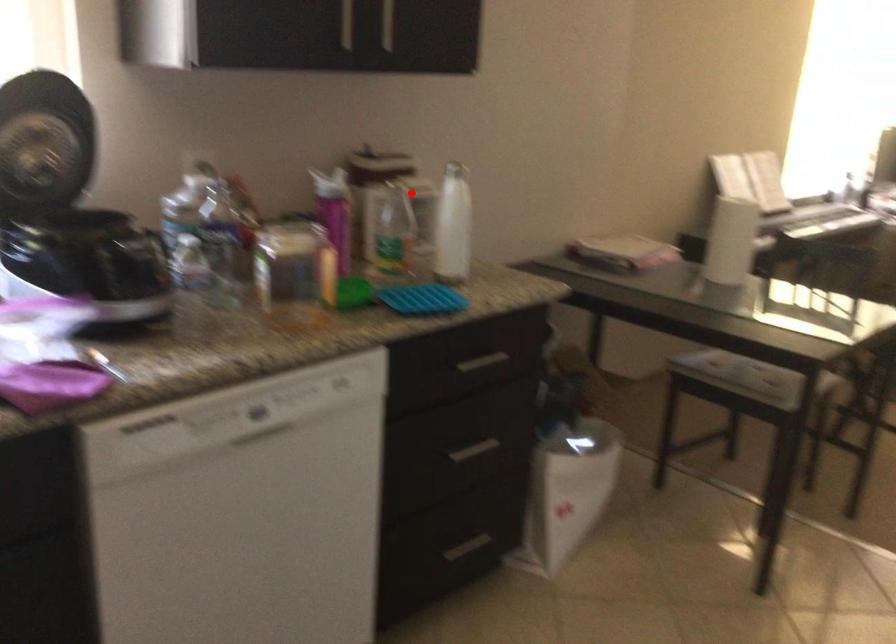
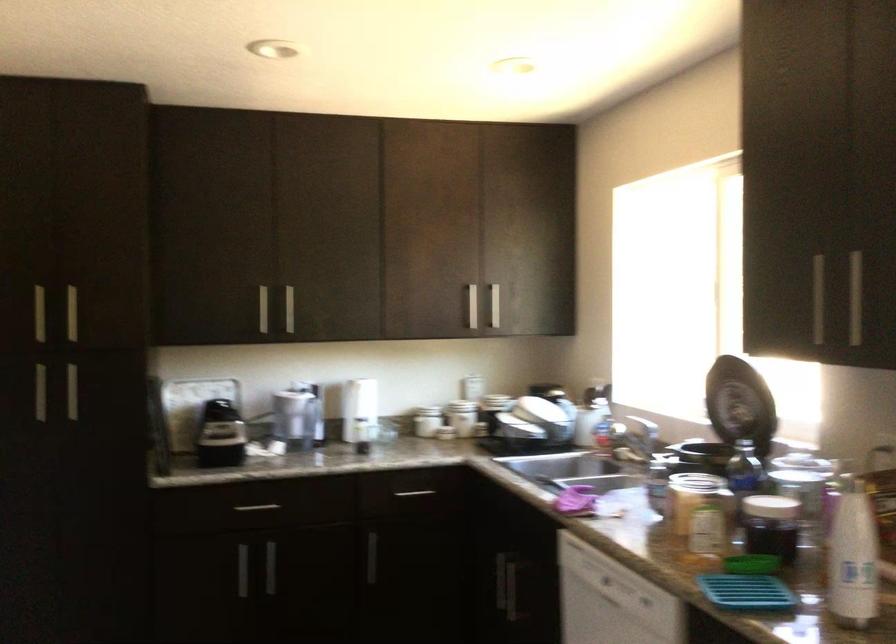
Question: I am providing you with two images of the same scene from different viewpoints. Image1 has a red point marked. In image2, the corresponding 3D location appears at what relative position? Reply with the corresponding letter.

Choices:
 (A) Closer
 (B) Farther

Answer: (A)